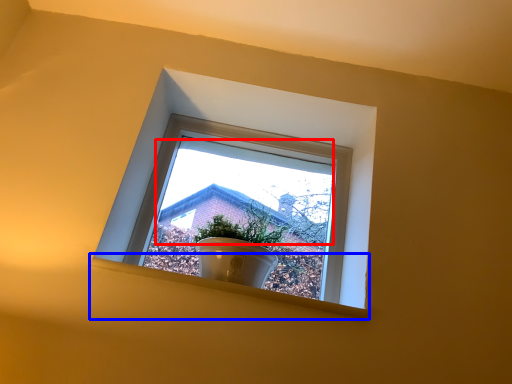
Question: Among these objects, which one is nearest to the camera, morning light (highlighted by a red box) or window sill (highlighted by a blue box)?

Choices:
 (A) morning light
 (B) window sill

Answer: (A)